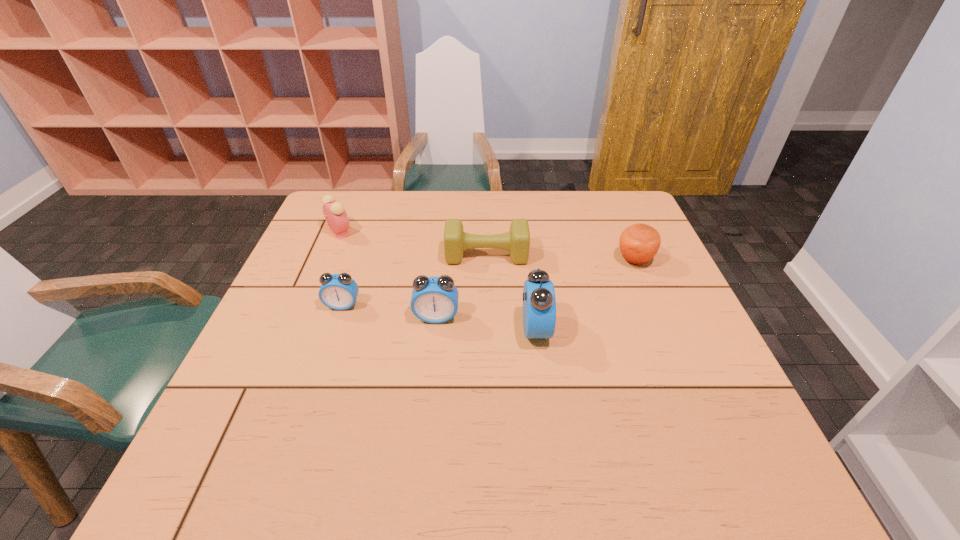
Find the location of a particular element. Image resolution: width=960 pixels, height=540 pixels. free space that satisfies the following two spatial constraints: 1. on the face of the orange; 2. on the right side of the farthest alarm clock is located at coordinates (328, 260).